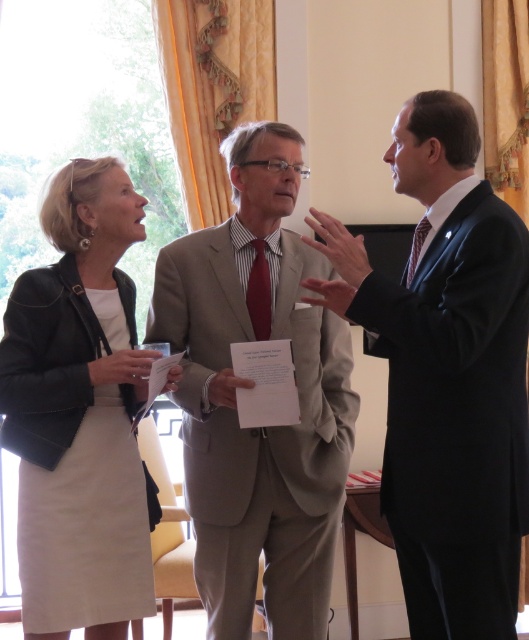
Question: Is light beige suit at center to the right of leather jacket at left from the viewer's perspective?

Choices:
 (A) yes
 (B) no

Answer: (A)

Question: Which object is farther from the camera taking this photo?

Choices:
 (A) light beige suit at center
 (B) leather jacket at left

Answer: (A)

Question: Can you confirm if dark blue suit at right is smaller than leather jacket at left?

Choices:
 (A) no
 (B) yes

Answer: (A)

Question: Does light beige suit at center appear over leather jacket at left?

Choices:
 (A) yes
 (B) no

Answer: (A)

Question: Based on their relative distances, which object is nearer to the leather jacket at left?

Choices:
 (A) dark blue suit at right
 (B) light beige suit at center

Answer: (B)

Question: Which of the following is the closest to the observer?

Choices:
 (A) (197, 500)
 (B) (324, 216)
 (C) (30, 586)

Answer: (C)